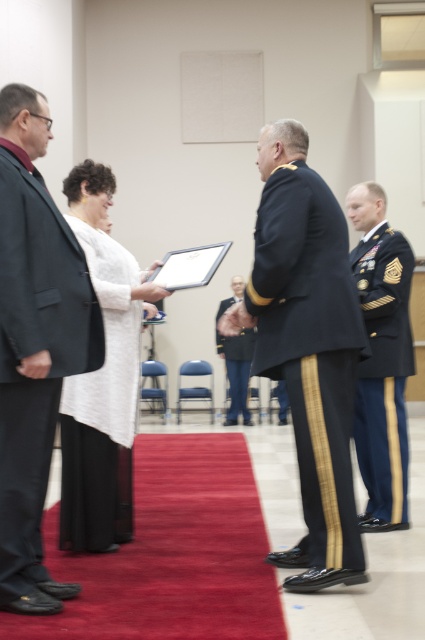
You are an event planner organizing a ceremony. You need to arrange a podium for the presenter wearing the white matte jacket at center and the recipient in the dark green military uniform at right. Based on their heights, which person should stand on the higher platform to ensure eye contact during the presentation?

The white matte jacket at center should stand on the higher platform because it has a greater height compared to the dark green military uniform at right, ensuring proper eye contact during the presentation.

You are a photographer at the ceremony. You want to capture a photo that includes both the navy blue fabric uniform at center and the dark green military uniform at right. The camera has a 1.5 meter focal range. Can you position yourself so that both subjects are within the focal range?

The navy blue fabric uniform at center is 1.01 meters from the dark green military uniform at right. Since the distance between them is less than 1.5 meters, positioning the camera between them would ensure both are within the 1.5 meter focal range.

You are an event planner arranging seating for the ceremony. You need to determine which of the two central figures, the navy blue fabric uniform at center or the white matte jacket at center, requires a larger chair. Based on the scene description, which one needs a bigger seat?

The white matte jacket at center requires a larger chair since the navy blue fabric uniform at center has a smaller size compared to it.